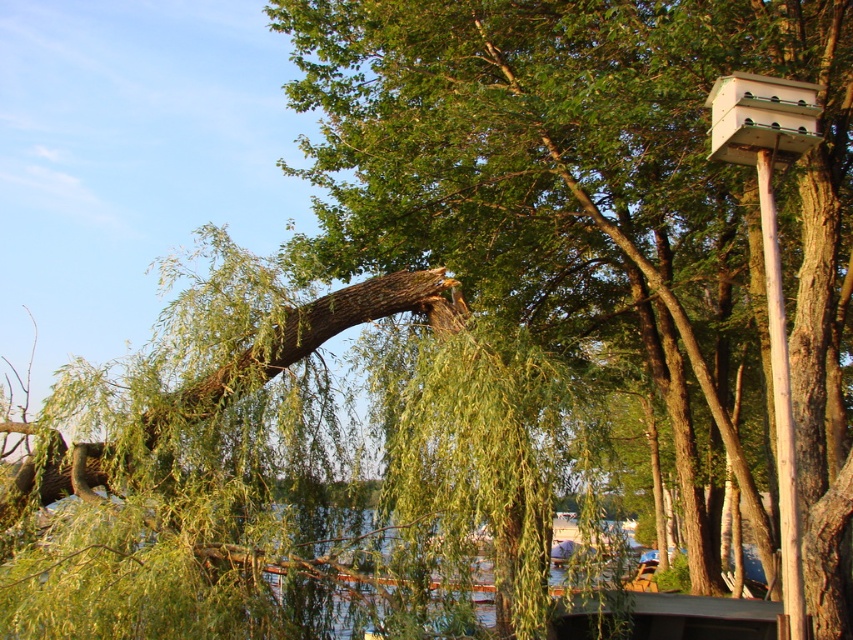
What do you see at coordinates (291, 468) in the screenshot?
I see `green leafy willow at center` at bounding box center [291, 468].

Between green leafy willow at center and white plastic bird feeder at upper right, which one has more height?

green leafy willow at center

Does point (273, 413) come closer to viewer compared to point (798, 141)?

No, (273, 413) is behind (798, 141).

The width and height of the screenshot is (853, 640). Identify the location of green leafy willow at center. (291, 468).

Does green leafy willow at center have a greater height compared to green leafy water at lower center?

Indeed, green leafy willow at center has a greater height compared to green leafy water at lower center.

Is green leafy willow at center to the left of green leafy water at lower center from the viewer's perspective?

No, green leafy willow at center is not to the left of green leafy water at lower center.

Find the location of a particular element. green leafy willow at center is located at coordinates (291, 468).

Where is `green leafy willow at center`? green leafy willow at center is located at coordinates (291, 468).

Is green leafy water at lower center closer to camera compared to white plastic bird feeder at upper right?

Yes, green leafy water at lower center is closer to the viewer.

Does green leafy water at lower center appear on the right side of white plastic bird feeder at upper right?

Incorrect, green leafy water at lower center is not on the right side of white plastic bird feeder at upper right.

What do you see at coordinates (181, 589) in the screenshot?
I see `green leafy water at lower center` at bounding box center [181, 589].

The height and width of the screenshot is (640, 853). I want to click on green leafy water at lower center, so click(181, 589).